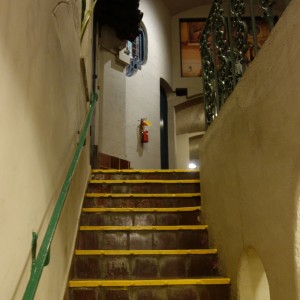
Find the location of a particular element. Image resolution: width=300 pixels, height=300 pixels. stairs is located at coordinates (160, 289), (168, 267), (168, 238), (166, 216), (166, 199), (168, 188), (168, 172).